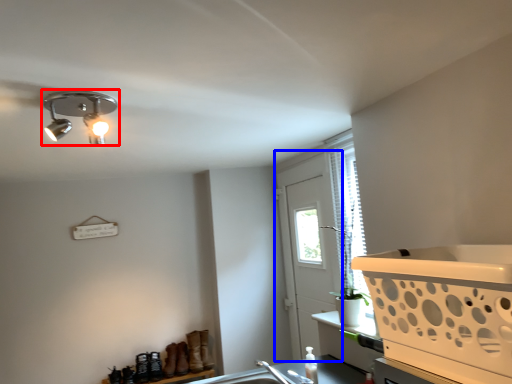
Question: Among these objects, which one is farthest to the camera, lamp (highlighted by a red box) or screen door (highlighted by a blue box)?

Choices:
 (A) lamp
 (B) screen door

Answer: (B)